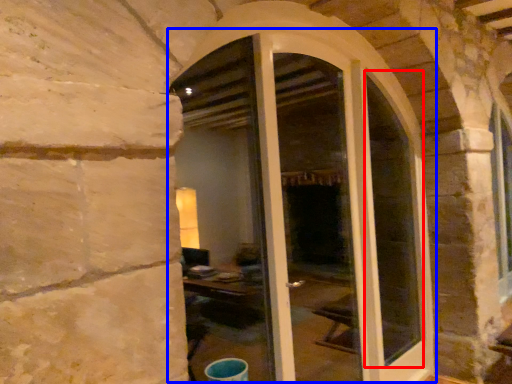
Question: Which object appears farthest to the camera in this image, glass window (highlighted by a red box) or door (highlighted by a blue box)?

Choices:
 (A) glass window
 (B) door

Answer: (A)